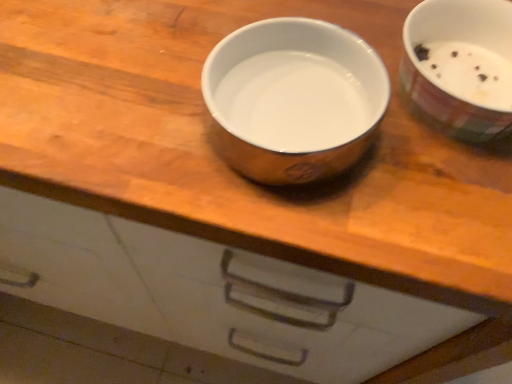
Question: Is satin silver bowl at center, which is the 2th tableware in right-to-left order, wider or thinner than white glossy bowl at upper right, which appears as the first tableware when viewed from the right?

Choices:
 (A) wide
 (B) thin

Answer: (B)

Question: Visually, is satin silver bowl at center, marked as the 1th tableware in a left-to-right arrangement, positioned to the left or to the right of white glossy bowl at upper right, the 2th tableware from the left?

Choices:
 (A) left
 (B) right

Answer: (A)

Question: Considering their positions, is satin silver bowl at center, which is the 2th tableware in right-to-left order, located in front of or behind white glossy bowl at upper right, the 2th tableware from the left?

Choices:
 (A) front
 (B) behind

Answer: (A)

Question: From a real-world perspective, is white glossy bowl at upper right, which appears as the first tableware when viewed from the right, above or below satin silver bowl at center, which is the 2th tableware in right-to-left order?

Choices:
 (A) above
 (B) below

Answer: (A)

Question: Is white glossy bowl at upper right, the 2th tableware from the left, situated inside satin silver bowl at center, marked as the 1th tableware in a left-to-right arrangement, or outside?

Choices:
 (A) inside
 (B) outside

Answer: (B)

Question: Considering the positions of white glossy bowl at upper right, the 2th tableware from the left, and satin silver bowl at center, which is the 2th tableware in right-to-left order, in the image, is white glossy bowl at upper right, the 2th tableware from the left, wider or thinner than satin silver bowl at center, which is the 2th tableware in right-to-left order,?

Choices:
 (A) wide
 (B) thin

Answer: (A)

Question: From the image's perspective, is white glossy bowl at upper right, the 2th tableware from the left, positioned above or below satin silver bowl at center, which is the 2th tableware in right-to-left order?

Choices:
 (A) below
 (B) above

Answer: (B)